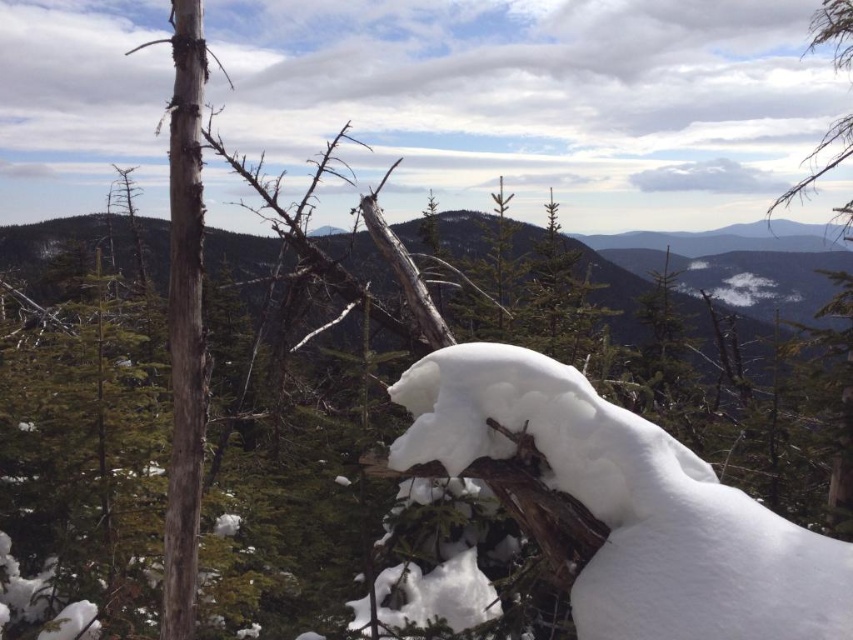
Does white fluffy snow at center have a smaller size compared to green matte tree at upper center?

Correct, white fluffy snow at center occupies less space than green matte tree at upper center.

Is point (509, 403) positioned before point (733, 312)?

Yes, point (509, 403) is closer to viewer.

Between point (578, 465) and point (80, 225), which one is positioned in front?

Point (578, 465) is in front.

You are a GUI agent. You are given a task and a screenshot of the screen. Output one action in this format:
    pyautogui.click(x=<x>, y=<y>)
    Task: Click on the white fluffy snow at center
    Image resolution: width=853 pixels, height=640 pixels.
    Given the screenshot: What is the action you would take?
    pyautogui.click(x=630, y=504)